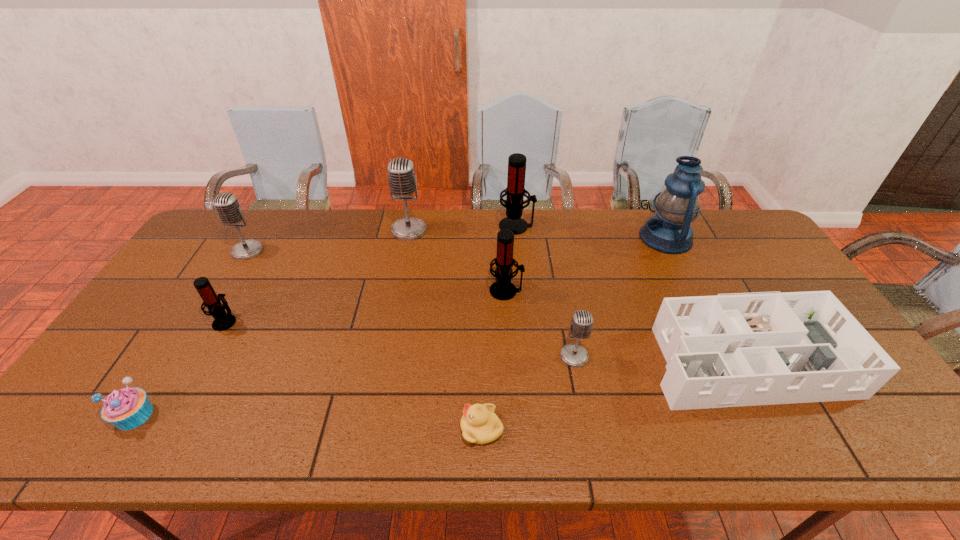
The image size is (960, 540). Find the location of `lantern`. lantern is located at coordinates (669, 231).

The height and width of the screenshot is (540, 960). In order to click on the farthest red microphone in this screenshot , I will do `click(515, 191)`.

At what (x,y) coordinates should I click in order to perform the action: click on the fourth microphone from right to left. Please return your answer as a coordinate pair (x, y). The width and height of the screenshot is (960, 540). Looking at the image, I should click on click(x=402, y=182).

This screenshot has height=540, width=960. Find the location of `the fourth object from left to right`. the fourth object from left to right is located at coordinates (402, 182).

The image size is (960, 540). Identify the location of the leftmost gray microphone. (227, 206).

Identify the location of the second farthest gray microphone. The height and width of the screenshot is (540, 960). (227, 206).

Where is `the sixth nearest object`? Image resolution: width=960 pixels, height=540 pixels. the sixth nearest object is located at coordinates (502, 289).

You are a GUI agent. You are given a task and a screenshot of the screen. Output one action in this format:
    pyautogui.click(x=<x>, y=<y>)
    Task: Click on the second biggest red microphone
    
    Given the screenshot: What is the action you would take?
    pyautogui.click(x=502, y=289)

Locate an element on the screen. This screenshot has height=540, width=960. the smallest red microphone is located at coordinates (223, 321).

Locate an element on the screen. The image size is (960, 540). the leftmost red microphone is located at coordinates (223, 321).